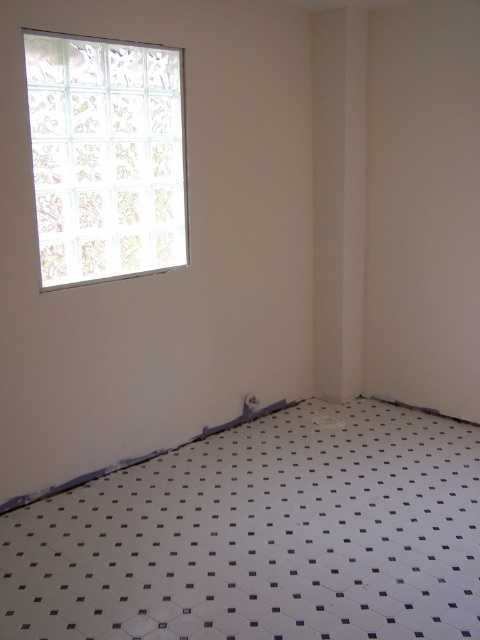
Is white glossy tile at lower center positioned at the back of frosted glass window at upper left?

No, it is not.

Between point (309, 464) and point (57, 195), which one is positioned in front?

Point (57, 195) is in front.

I want to click on white glossy tile at lower center, so click(x=262, y=536).

Find the location of a particular element. white glossy tile at lower center is located at coordinates (262, 536).